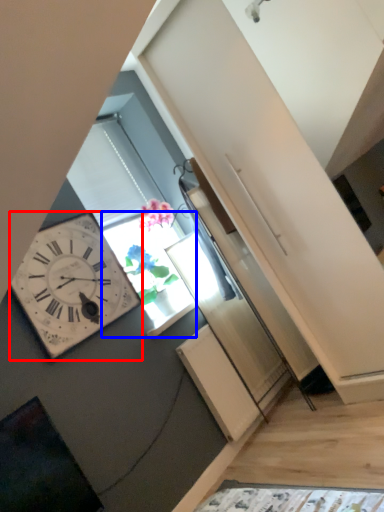
Question: Among these objects, which one is nearest to the camera, wall clock (highlighted by a red box) or window (highlighted by a blue box)?

Choices:
 (A) wall clock
 (B) window

Answer: (A)